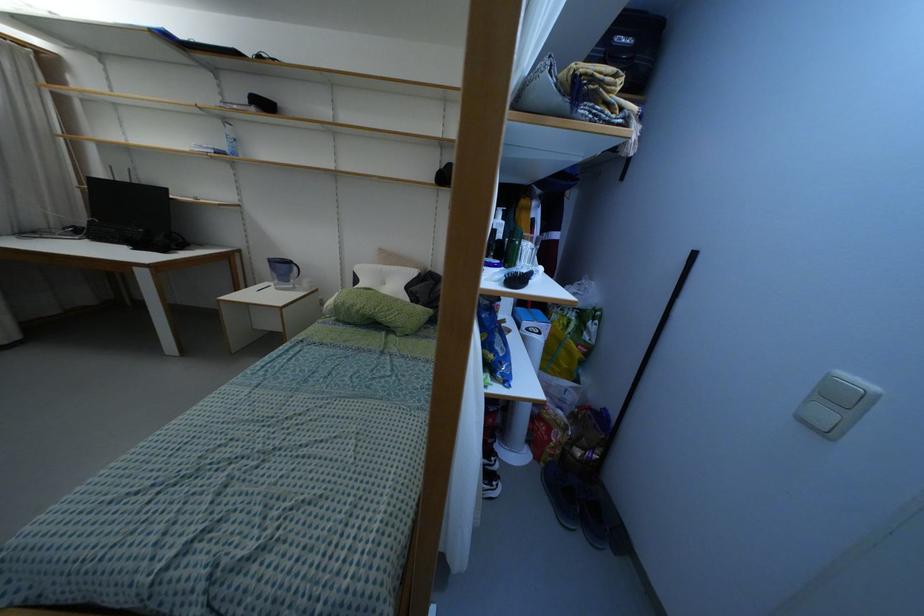
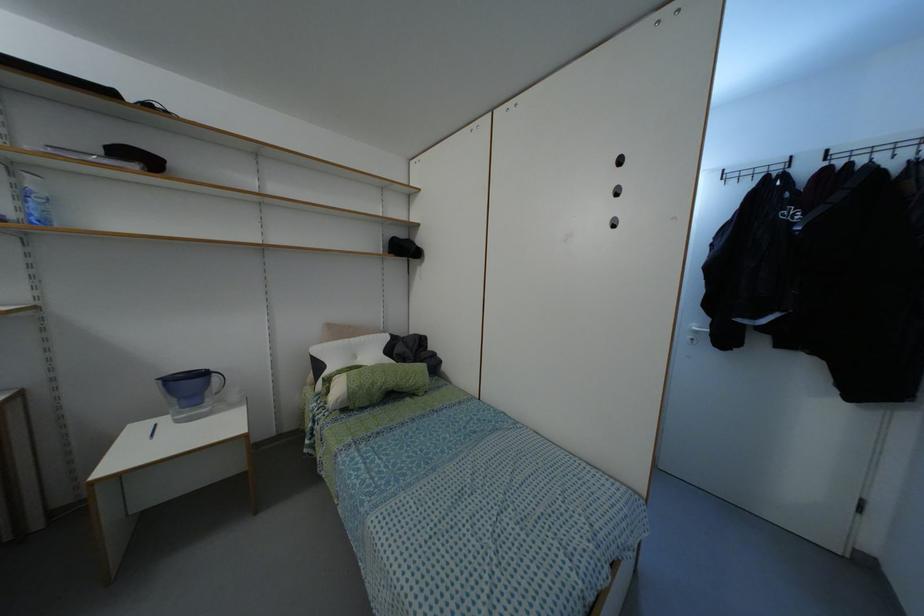
In the second image, find the point that corresponds to point (295, 268) in the first image.

(214, 378)